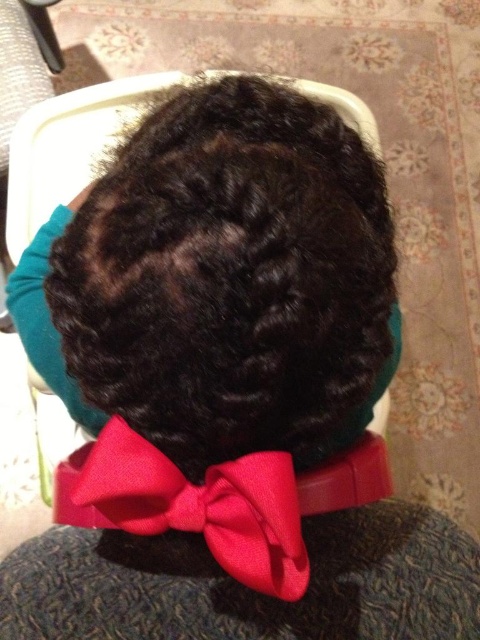
You are a photographer taking a portrait of the person in the high chair. You want to ensure both the curly dark brown hair at center and the shiny red bow tie at center are clearly visible. Which object will appear wider in the photo?

The curly dark brown hair at center will appear wider in the photo since its width surpasses that of the shiny red bow tie at center.

You are a photographer trying to capture a closeup of the shiny red bow tie at center without including the curly dark brown hair at center in the frame. Is this possible given their positions?

The curly dark brown hair at center is positioned over the shiny red bow tie at center, so it would be difficult to capture the bow tie without including the hair in the frame.

Based on the provided image description, what are the coordinates of the curly dark brown hair at center?

The curly dark brown hair at center is located at coordinates point (231, 276).